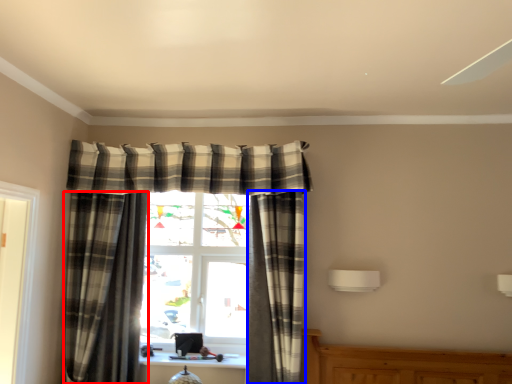
Question: Which point is further to the camera, curtain (highlighted by a red box) or curtain (highlighted by a blue box)?

Choices:
 (A) curtain
 (B) curtain

Answer: (B)